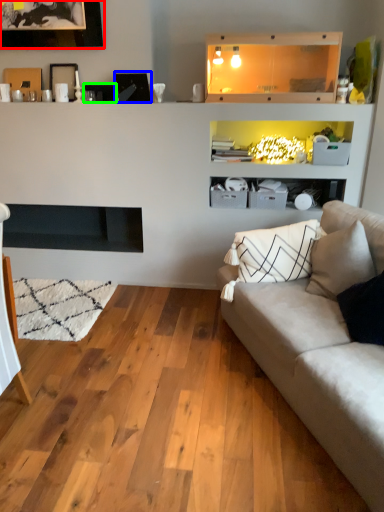
Question: Which is nearer to the picture frame (highlighted by a red box)? picture frame (highlighted by a blue box) or picture frame (highlighted by a green box).

Choices:
 (A) picture frame
 (B) picture frame

Answer: (B)